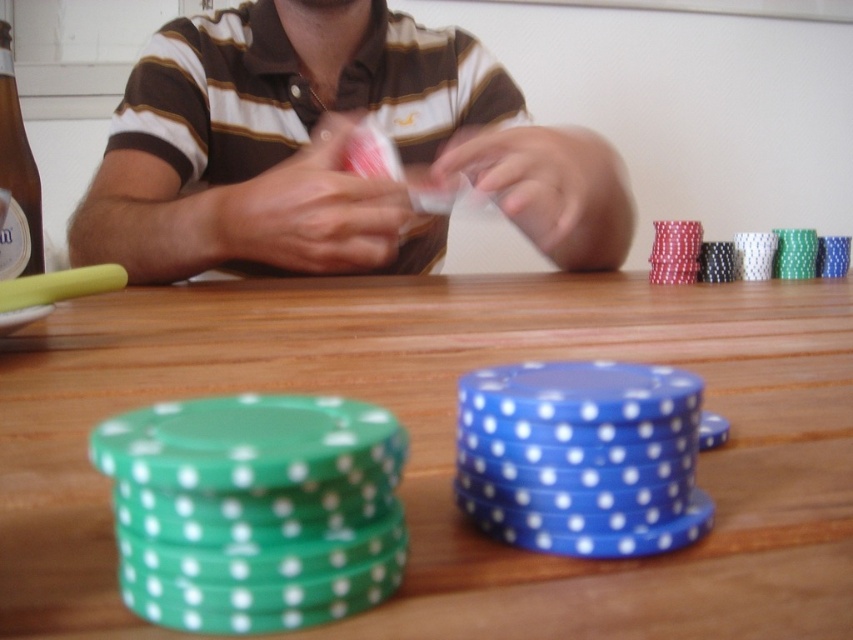
Question: Can you confirm if green plastic chips at lower left is smaller than matte brown shirt at upper center?

Choices:
 (A) no
 (B) yes

Answer: (B)

Question: Which point is closer to the camera?

Choices:
 (A) (392, 326)
 (B) (498, 141)

Answer: (A)

Question: Is the position of green plastic chips at lower left less distant than that of matte brown shirt at upper center?

Choices:
 (A) no
 (B) yes

Answer: (B)

Question: Can you confirm if green plastic chips at lower left is positioned to the left of matte brown shirt at upper center?

Choices:
 (A) no
 (B) yes

Answer: (A)